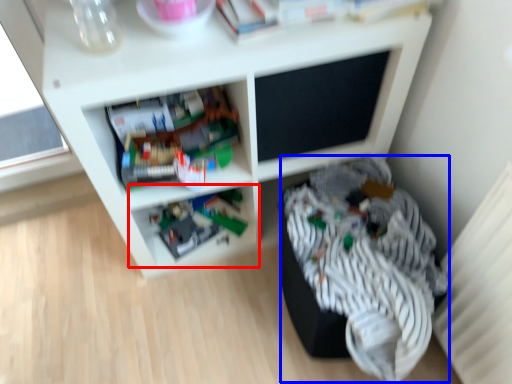
Question: Which of the following is the farthest to the observer, shelf (highlighted by a red box) or clothing (highlighted by a blue box)?

Choices:
 (A) shelf
 (B) clothing

Answer: (A)